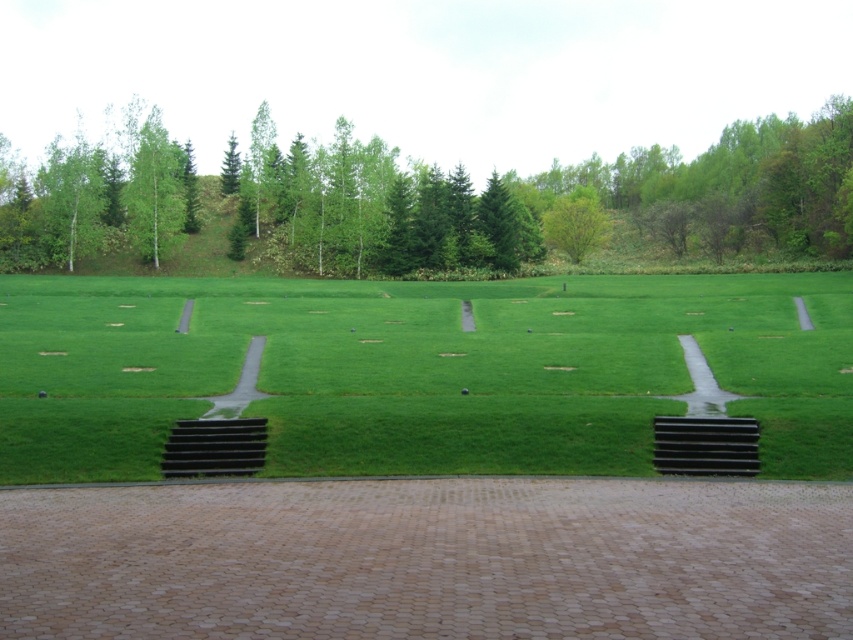
Question: Which object is the farthest from the green leafy tree at upper right?

Choices:
 (A) green leafy tree at upper center
 (B) green grass at center
 (C) green matte tree at upper left

Answer: (C)

Question: Is green grass at center wider than green leafy tree at upper center?

Choices:
 (A) no
 (B) yes

Answer: (B)

Question: Among these objects, which one is nearest to the camera?

Choices:
 (A) green leafy tree at upper right
 (B) green grass at center
 (C) green leafy tree at upper center

Answer: (B)

Question: Which object appears farthest from the camera in this image?

Choices:
 (A) green leafy tree at upper right
 (B) green grass at center

Answer: (A)

Question: From the image, what is the correct spatial relationship of green grass at center in relation to green leafy tree at upper center?

Choices:
 (A) left
 (B) right

Answer: (A)

Question: Is green grass at center below green matte tree at upper left?

Choices:
 (A) no
 (B) yes

Answer: (B)